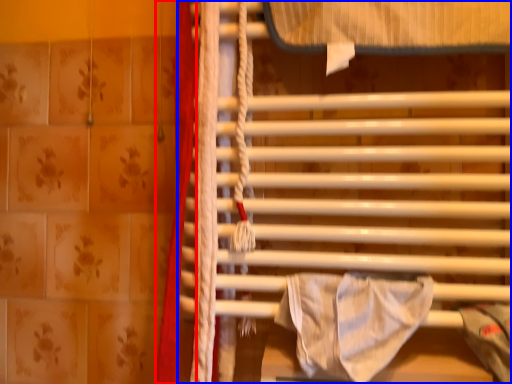
Question: Which object appears closest to the camera in this image, curtain (highlighted by a red box) or furniture (highlighted by a blue box)?

Choices:
 (A) curtain
 (B) furniture

Answer: (B)